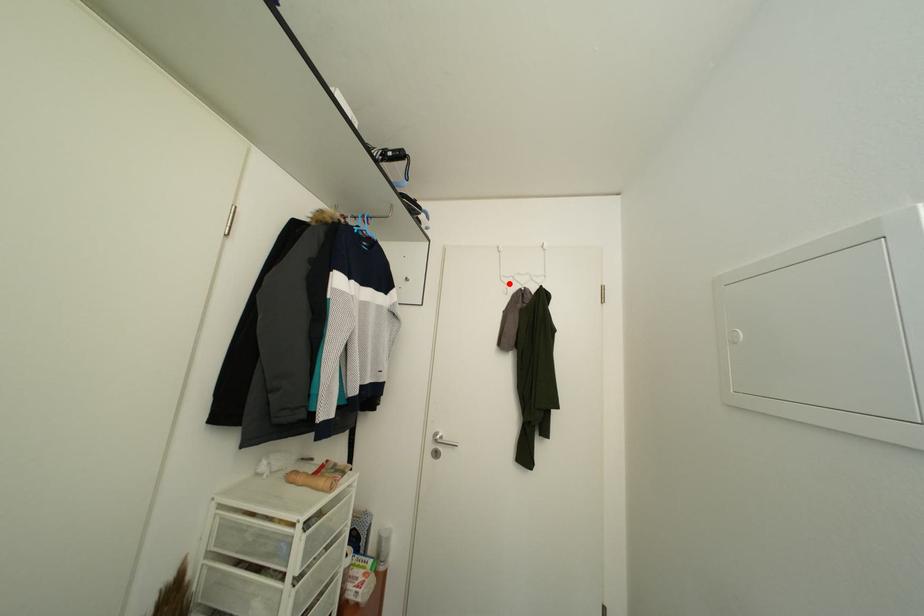
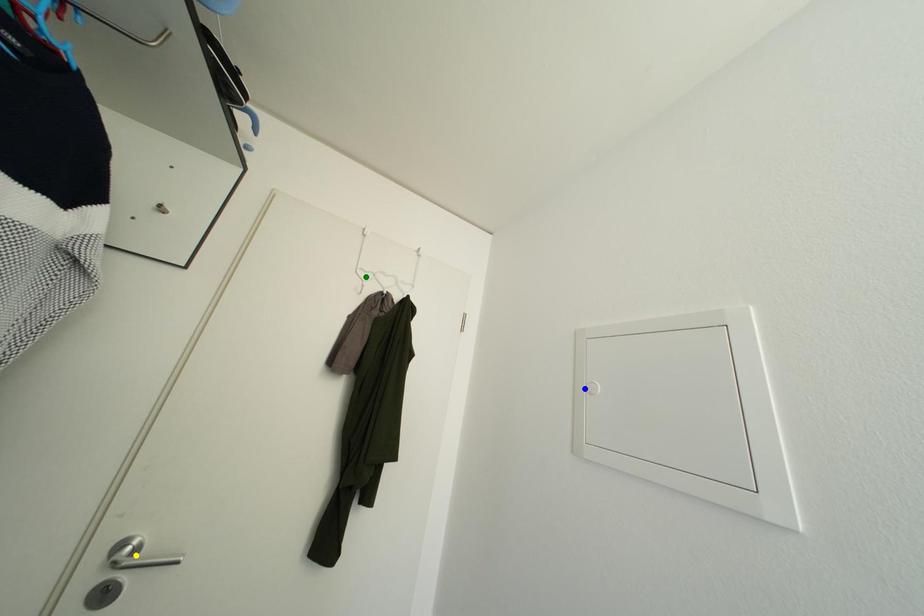
Question: I am providing you with two images of the same scene from different viewpoints. A red point is marked on the first image. You are given multiple points on the second image. Which mark in image 2 goes with the point in image 1?

Choices:
 (A) green point
 (B) yellow point
 (C) blue point

Answer: (A)